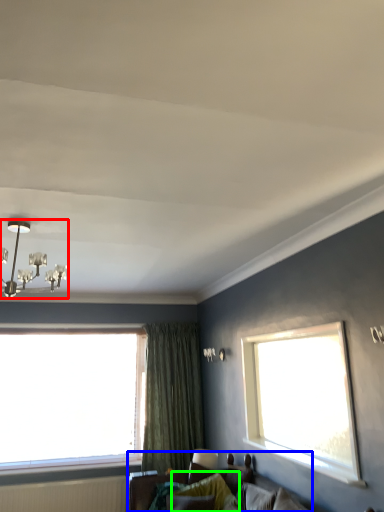
Question: Considering the real-world distances, which object is closest to light fixture (highlighted by a red box)? studio couch (highlighted by a blue box) or pillow (highlighted by a green box).

Choices:
 (A) studio couch
 (B) pillow

Answer: (A)